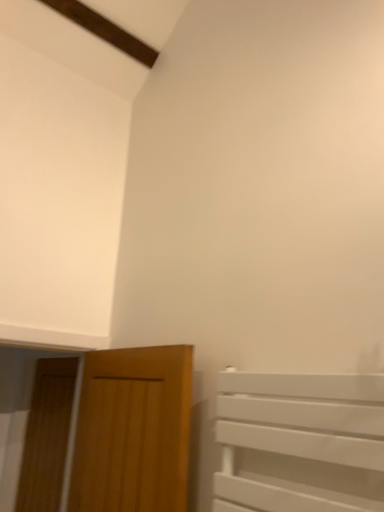
What do you see at coordinates (133, 431) in the screenshot? I see `wooden door at lower left, marked as the 2th door in a left-to-right arrangement` at bounding box center [133, 431].

From the picture: Measure the distance between wooden door at lower left, marked as the 2th door in a left-to-right arrangement, and camera.

1.39 meters.

Where is `wooden door at lower left, the first door from the front`? wooden door at lower left, the first door from the front is located at coordinates (133, 431).

Where is `wooden door at left, acting as the 2th door starting from the right`? The image size is (384, 512). wooden door at left, acting as the 2th door starting from the right is located at coordinates click(x=47, y=435).

Describe the element at coordinates (47, 435) in the screenshot. I see `wooden door at left, acting as the 2th door starting from the right` at that location.

At what (x,y) coordinates should I click in order to perform the action: click on wooden door at lower left, the first door from the front. Please return your answer as a coordinate pair (x, y). The image size is (384, 512). Looking at the image, I should click on (133, 431).

Would you say wooden door at left, which is the first door in back-to-front order, is to the left or to the right of wooden door at lower left, marked as the 2th door in a left-to-right arrangement, in the picture?

Based on their positions, wooden door at left, which is the first door in back-to-front order, is located to the left of wooden door at lower left, marked as the 2th door in a left-to-right arrangement.

Between wooden door at left, which is counted as the second door, starting from the front, and wooden door at lower left, marked as the 2th door in a left-to-right arrangement, which one is positioned behind?

wooden door at left, which is counted as the second door, starting from the front, is further away from the camera.

Is point (21, 466) in front of point (93, 441)?

No, it is behind (93, 441).

From the image's perspective, which is above, wooden door at left, which is the first door in back-to-front order, or wooden door at lower left, the second door in the back-to-front sequence?

wooden door at lower left, the second door in the back-to-front sequence, appears higher in the image.

From a real-world perspective, which is physically below, wooden door at left, which ranks as the 1th door in left-to-right order, or wooden door at lower left, the first door from the front?

wooden door at left, which ranks as the 1th door in left-to-right order, from a real-world perspective.

In terms of width, does wooden door at left, which is counted as the second door, starting from the front, look wider or thinner when compared to wooden door at lower left, marked as the 2th door in a left-to-right arrangement?

Considering their sizes, wooden door at left, which is counted as the second door, starting from the front, looks slimmer than wooden door at lower left, marked as the 2th door in a left-to-right arrangement.

Who is taller, wooden door at left, which is counted as the second door, starting from the front, or wooden door at lower left, which is the 1th door in right-to-left order?

With more height is wooden door at left, which is counted as the second door, starting from the front.

Considering the sizes of objects wooden door at left, which ranks as the 1th door in left-to-right order, and wooden door at lower left, marked as the 2th door in a left-to-right arrangement, in the image provided, who is smaller, wooden door at left, which ranks as the 1th door in left-to-right order, or wooden door at lower left, marked as the 2th door in a left-to-right arrangement,?

With smaller size is wooden door at left, which ranks as the 1th door in left-to-right order.

Looking at this image, can wooden door at lower left, the first door from the front, be found inside wooden door at left, which is the first door in back-to-front order?

Actually, wooden door at lower left, the first door from the front, is outside wooden door at left, which is the first door in back-to-front order.

Can you see wooden door at left, which is the first door in back-to-front order, touching wooden door at lower left, the first door from the front?

No, wooden door at left, which is the first door in back-to-front order, is not next to wooden door at lower left, the first door from the front.

From the picture: Is wooden door at left, which is the first door in back-to-front order, oriented towards wooden door at lower left, the first door from the front?

No.

Measure the distance from wooden door at left, which is counted as the second door, starting from the front, to wooden door at lower left, the first door from the front.

A distance of 34.00 inches exists between wooden door at left, which is counted as the second door, starting from the front, and wooden door at lower left, the first door from the front.

Identify the location of door that is under the wooden door at lower left, which is the 1th door in right-to-left order (from a real-world perspective). (47, 435).

Which is more to the left, wooden door at lower left, marked as the 2th door in a left-to-right arrangement, or wooden door at left, which ranks as the 1th door in left-to-right order?

Positioned to the left is wooden door at left, which ranks as the 1th door in left-to-right order.

Which object is further away from the camera, wooden door at lower left, the second door in the back-to-front sequence, or wooden door at left, acting as the 2th door starting from the right?

Positioned behind is wooden door at left, acting as the 2th door starting from the right.

Which is behind, point (42, 402) or point (49, 436)?

The point (42, 402) is behind.

From the image's perspective, is wooden door at lower left, the second door in the back-to-front sequence, positioned above or below wooden door at left, acting as the 2th door starting from the right?

Clearly, from the image's perspective, wooden door at lower left, the second door in the back-to-front sequence, is above wooden door at left, acting as the 2th door starting from the right.

From a real-world perspective, between wooden door at lower left, the first door from the front, and wooden door at left, which ranks as the 1th door in left-to-right order, who is vertically lower?

wooden door at left, which ranks as the 1th door in left-to-right order, is physically lower.

From the picture: Does wooden door at lower left, the second door in the back-to-front sequence, have a greater width compared to wooden door at left, acting as the 2th door starting from the right?

Correct, the width of wooden door at lower left, the second door in the back-to-front sequence, exceeds that of wooden door at left, acting as the 2th door starting from the right.

Between wooden door at lower left, the first door from the front, and wooden door at left, which is the first door in back-to-front order, which one has more height?

Standing taller between the two is wooden door at left, which is the first door in back-to-front order.

Is wooden door at lower left, marked as the 2th door in a left-to-right arrangement, smaller than wooden door at left, which ranks as the 1th door in left-to-right order?

Actually, wooden door at lower left, marked as the 2th door in a left-to-right arrangement, might be larger than wooden door at left, which ranks as the 1th door in left-to-right order.

Looking at this image, is wooden door at lower left, the second door in the back-to-front sequence, not within wooden door at left, which ranks as the 1th door in left-to-right order?

Yes, wooden door at lower left, the second door in the back-to-front sequence, is located beyond the bounds of wooden door at left, which ranks as the 1th door in left-to-right order.

From the picture: Is wooden door at lower left, which is the 1th door in right-to-left order, next to wooden door at left, which is the first door in back-to-front order, and touching it?

No.

Is wooden door at left, acting as the 2th door starting from the right, at the back of wooden door at lower left, which is the 1th door in right-to-left order?

No, wooden door at lower left, which is the 1th door in right-to-left order, is not facing away from wooden door at left, acting as the 2th door starting from the right.

Where is `door on the left side of wooden door at lower left, which is the 1th door in right-to-left order`? door on the left side of wooden door at lower left, which is the 1th door in right-to-left order is located at coordinates (47, 435).

Image resolution: width=384 pixels, height=512 pixels. In the image, there is a wooden door at lower left, the first door from the front. In order to click on door below it (from a real-world perspective) in this screenshot , I will do `click(47, 435)`.

The width and height of the screenshot is (384, 512). I want to click on door that appears below the wooden door at lower left, the first door from the front (from the image's perspective), so pyautogui.click(x=47, y=435).